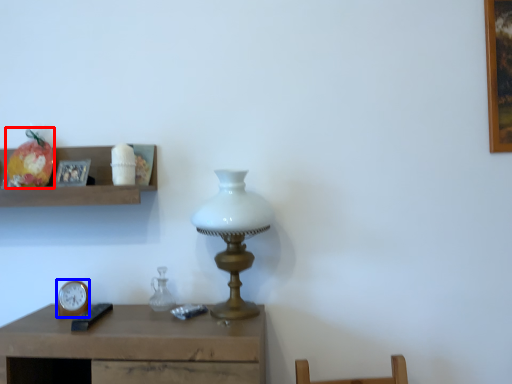
Question: Which point is further to the camera, fruit (highlighted by a red box) or clock (highlighted by a blue box)?

Choices:
 (A) fruit
 (B) clock

Answer: (A)